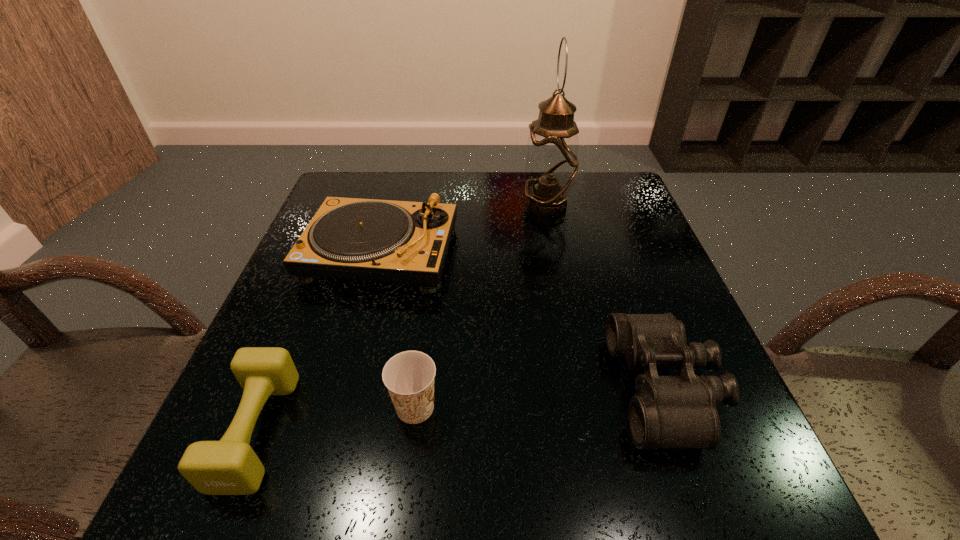
Locate an element on the screen. Image resolution: width=960 pixels, height=540 pixels. free space between the binoculars and the oil lamp is located at coordinates (606, 297).

Locate an element on the screen. The height and width of the screenshot is (540, 960). free point between the record player and the dumbbell is located at coordinates (319, 342).

Where is `vacant area that lies between the Dixie cup and the binoculars`? vacant area that lies between the Dixie cup and the binoculars is located at coordinates (540, 397).

The image size is (960, 540). In order to click on unoccupied position between the tallest object and the binoculars in this screenshot , I will do `click(606, 297)`.

Find the location of a particular element. This screenshot has width=960, height=540. free spot between the dumbbell and the oil lamp is located at coordinates (401, 318).

This screenshot has width=960, height=540. What are the coordinates of `free space between the dumbbell and the binoculars` in the screenshot? It's located at (461, 409).

The height and width of the screenshot is (540, 960). Find the location of `unoccupied position between the oil lamp and the record player`. unoccupied position between the oil lamp and the record player is located at coordinates (464, 229).

At what (x,y) coordinates should I click in order to perform the action: click on vacant space that is in between the binoculars and the dumbbell. Please return your answer as a coordinate pair (x, y). This screenshot has height=540, width=960. Looking at the image, I should click on (461, 409).

In order to click on empty space between the binoculars and the record player in this screenshot , I will do `click(523, 320)`.

The height and width of the screenshot is (540, 960). What are the coordinates of `object that is the second closest one to the oil lamp` in the screenshot? It's located at (680, 411).